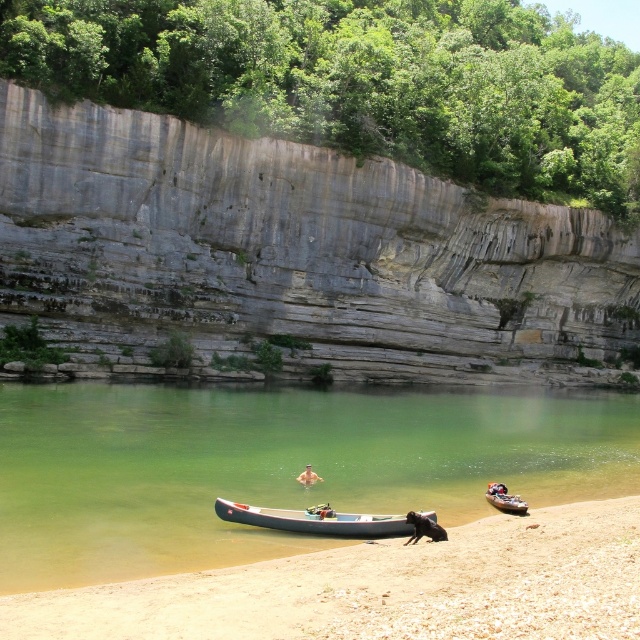
Does gray rock cliff at upper center have a smaller size compared to gray rubber canoe at center?

Incorrect, gray rock cliff at upper center is not smaller in size than gray rubber canoe at center.

Does gray rock cliff at upper center have a greater width compared to gray rubber canoe at center?

Indeed, gray rock cliff at upper center has a greater width compared to gray rubber canoe at center.

Is point (221, 289) less distant than point (320, 524)?

No.

Where is `gray rock cliff at upper center`? gray rock cliff at upper center is located at coordinates (292, 253).

Who is lower down, green translucent water at lower center or smooth tan skin at center?

smooth tan skin at center is lower down.

Can you confirm if green translucent water at lower center is thinner than smooth tan skin at center?

In fact, green translucent water at lower center might be wider than smooth tan skin at center.

Which is behind, point (604, 460) or point (305, 480)?

The point (604, 460) is more distant.

Identify the location of green translucent water at lower center. (273, 467).

Does brown sandy beach at lower center have a larger size compared to smooth tan skin at center?

Indeed, brown sandy beach at lower center has a larger size compared to smooth tan skin at center.

Is point (586, 627) positioned behind point (308, 484)?

No, it is not.

At what (x,y) coordinates should I click in order to perform the action: click on brown sandy beach at lower center. Please return your answer as a coordinate pair (x, y). Looking at the image, I should click on (381, 588).